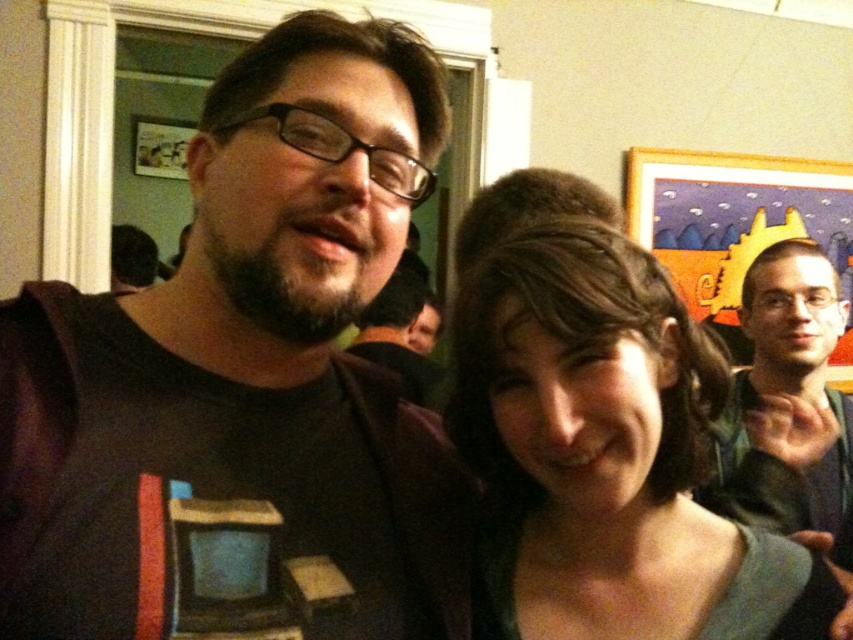
You are taking a photo of two points in the scene. The first point is labeled as point (x=601, y=518) and the second is point (x=785, y=500). Which point is closer to the camera?

Point (x=601, y=518) is closer to the camera than point (x=785, y=500).

You are organizing a clothing donation drive and need to categorize items by size. You have two green garments in front of you, the smooth green dress at center and the green fabric shirt at right. Which one should you place in the small size bin?

The smooth green dress at center is smaller than the green fabric shirt at right, so it should be placed in the small size bin.